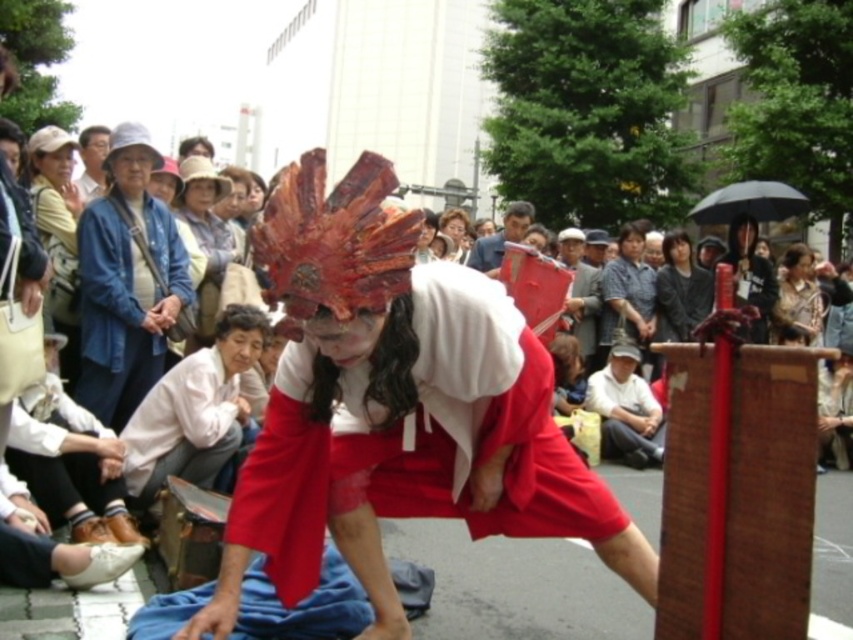
Can you confirm if denim shirt at center is thinner than smooth beige hair at center?

No.

How far apart are denim shirt at center and smooth beige hair at center?

They are 2.98 meters apart.

Measure the distance between point (x=621, y=253) and camera.

Point (x=621, y=253) is 15.69 meters from camera.

The height and width of the screenshot is (640, 853). I want to click on denim shirt at center, so click(x=630, y=288).

Is denim shirt at center taller than matte brown wooden box at center?

Yes.

Is point (628, 227) positioned in front of point (486, 273)?

No.

Where is `denim shirt at center`? The height and width of the screenshot is (640, 853). denim shirt at center is located at coordinates (630, 288).

Which is behind, point (608, 298) or point (680, 285)?

The point (680, 285) is behind.

Can you confirm if denim shirt at center is shorter than dark gray fabric at center?

No, denim shirt at center is not shorter than dark gray fabric at center.

In the scene shown: Who is more distant from viewer, (648, 282) or (695, 272)?

The point (648, 282) is behind.

At what (x,y) coordinates should I click in order to perform the action: click on denim shirt at center. Please return your answer as a coordinate pair (x, y). Looking at the image, I should click on (630, 288).